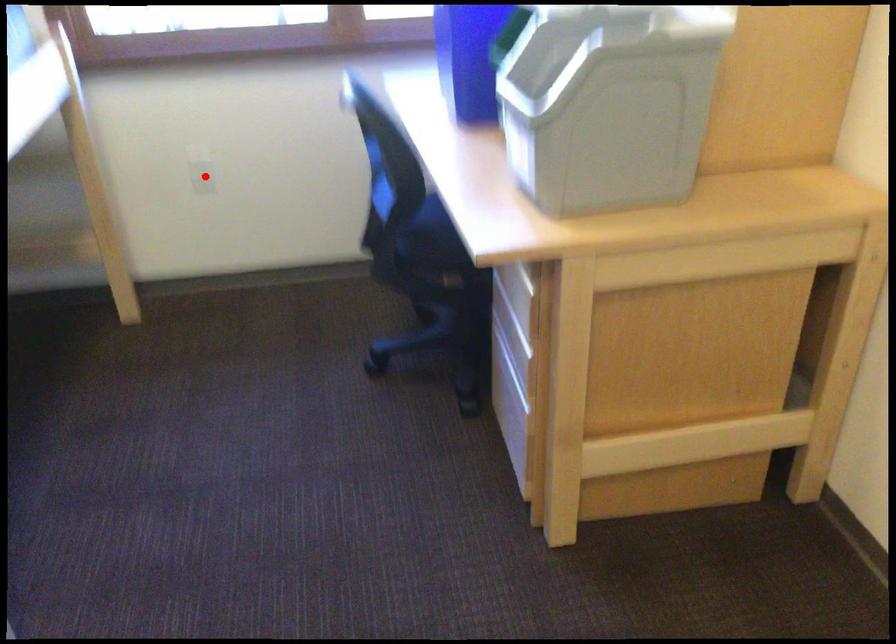
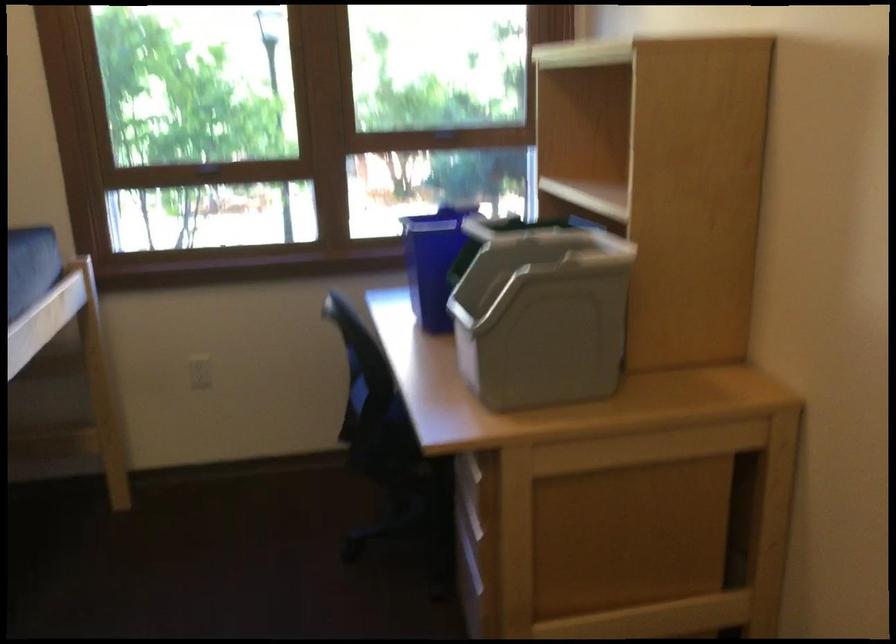
Locate, in the second image, the point that corresponds to the highlighted location in the first image.

(200, 372)